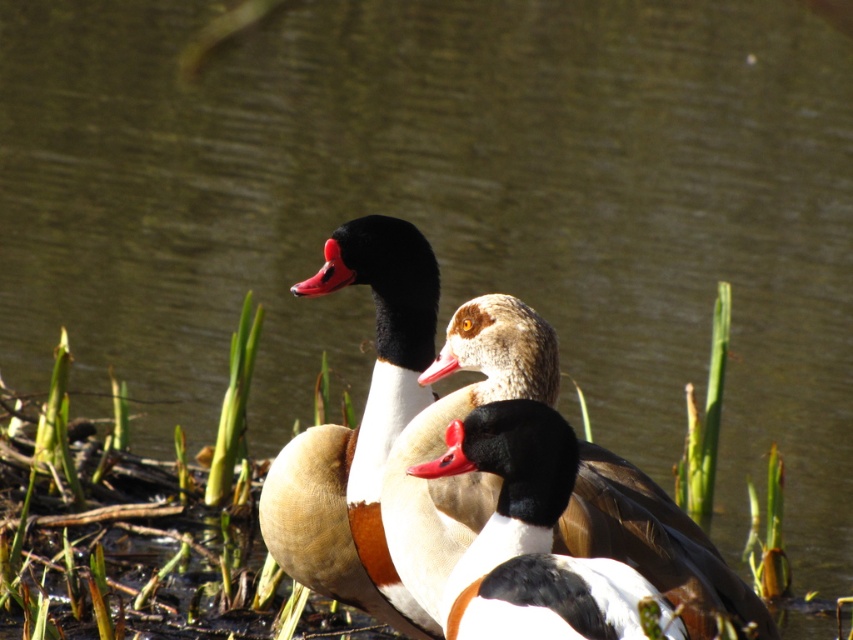
Is brown feathered duck at center behind white glossy duck at center?

Yes, brown feathered duck at center is behind white glossy duck at center.

Does brown feathered duck at center appear on the left side of white glossy duck at center?

Correct, you'll find brown feathered duck at center to the left of white glossy duck at center.

The height and width of the screenshot is (640, 853). What do you see at coordinates (358, 432) in the screenshot?
I see `brown feathered duck at center` at bounding box center [358, 432].

The height and width of the screenshot is (640, 853). What are the coordinates of `brown feathered duck at center` in the screenshot? It's located at (358, 432).